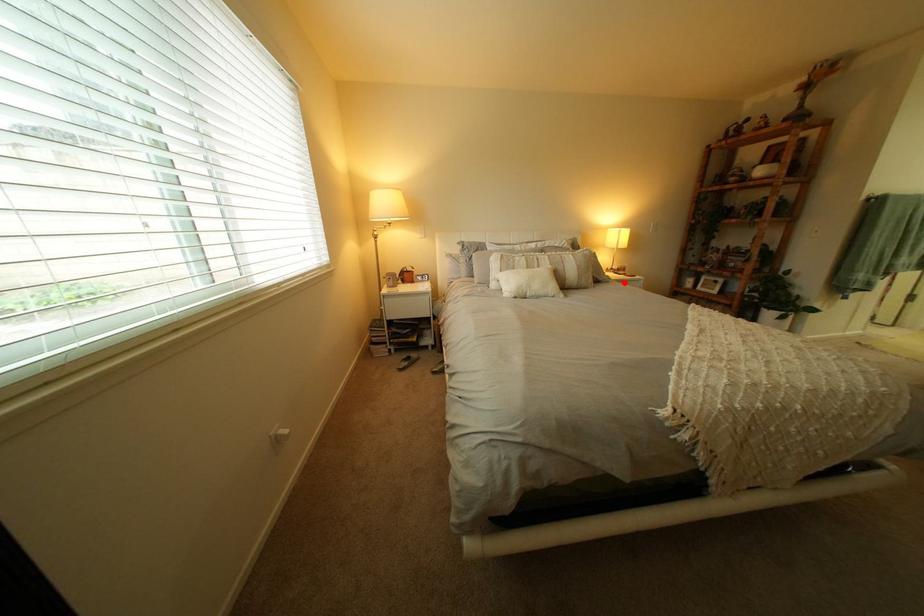
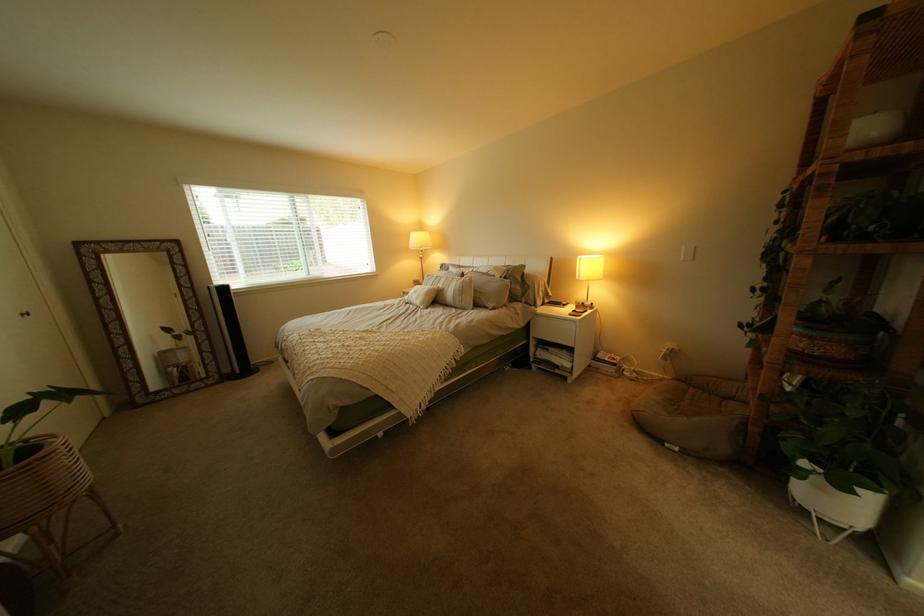
Where in the second image is the point corresponding to the highlighted location from the first image?

(509, 310)